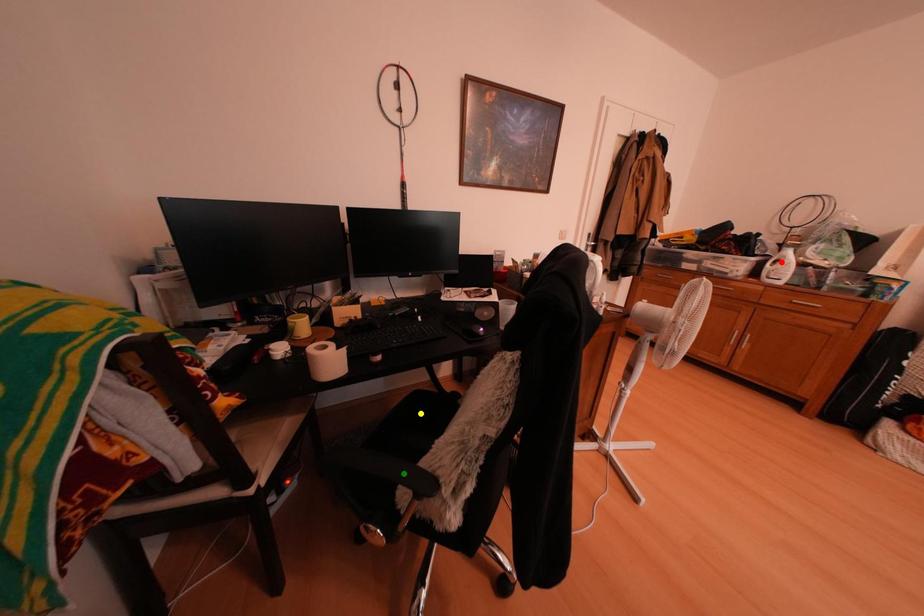
Order these from nearest to farthest:
1. green point
2. red point
3. yellow point

green point
yellow point
red point